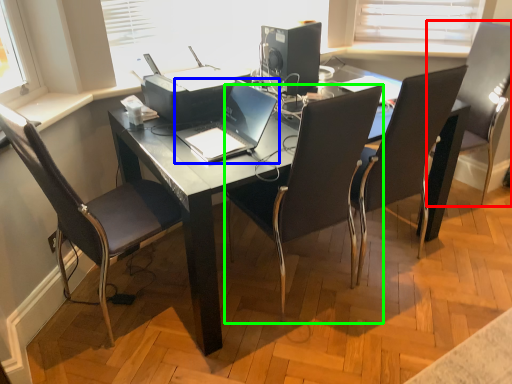
Question: Which is nearer to the chair (highlighted by a red box)? laptop (highlighted by a blue box) or chair (highlighted by a green box).

Choices:
 (A) laptop
 (B) chair

Answer: (B)